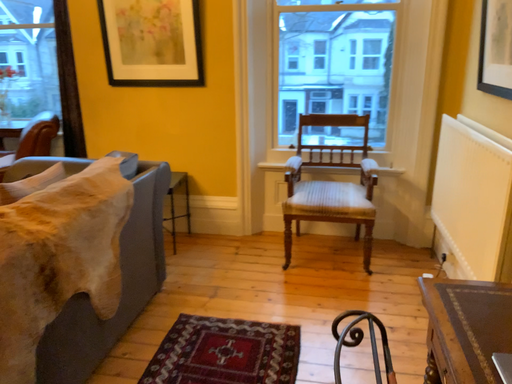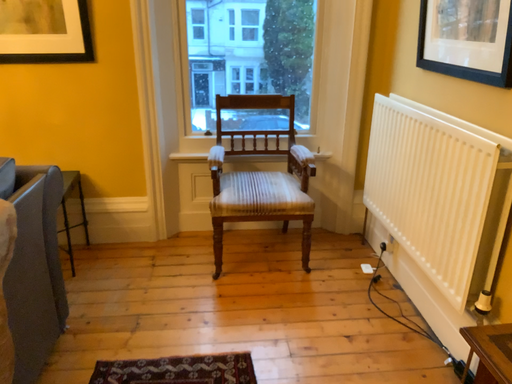
Question: How did the camera likely rotate when shooting the video?

Choices:
 (A) rotated left
 (B) rotated right

Answer: (B)